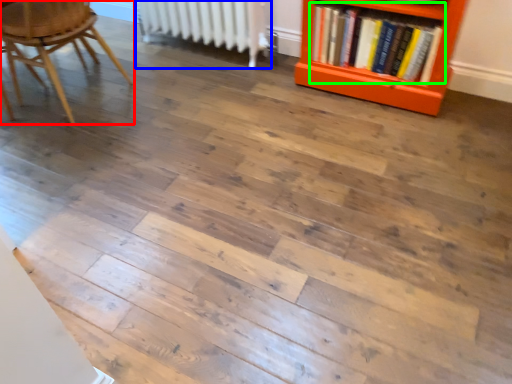
Question: Which object is the farthest from chair (highlighted by a red box)? Choose among these: radiator (highlighted by a blue box) or book (highlighted by a green box).

Choices:
 (A) radiator
 (B) book

Answer: (B)